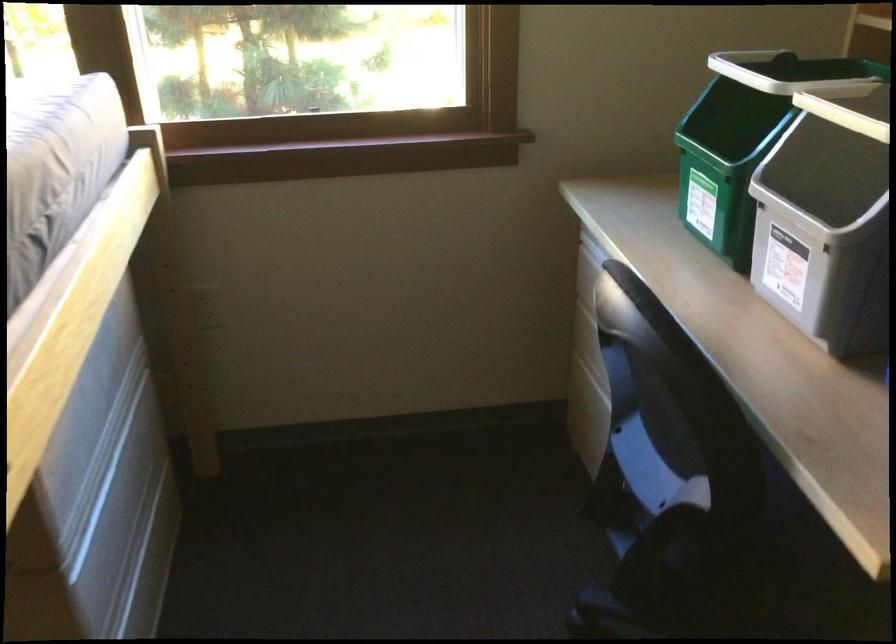
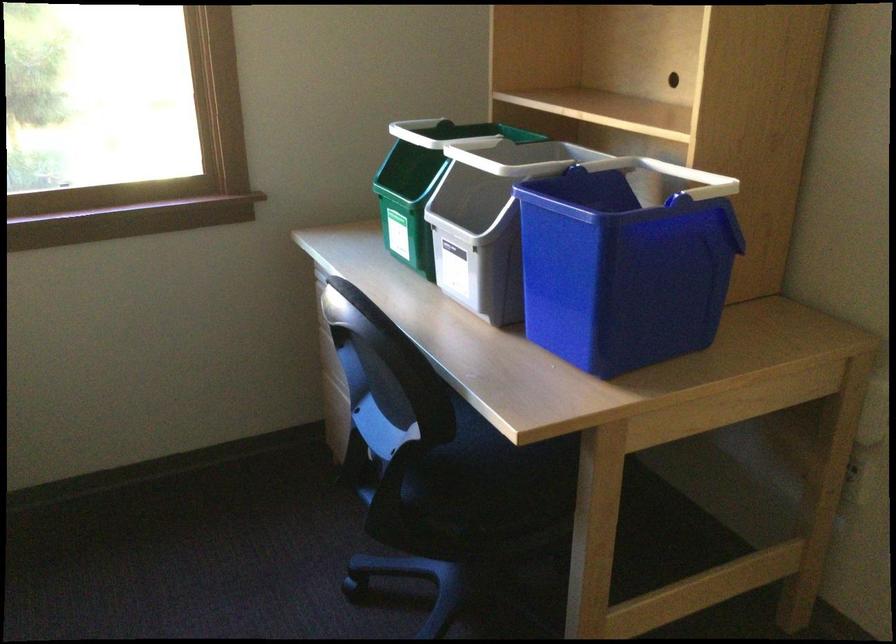
The point at (772, 544) is marked in the first image. Where is the corresponding point in the second image?

(479, 476)